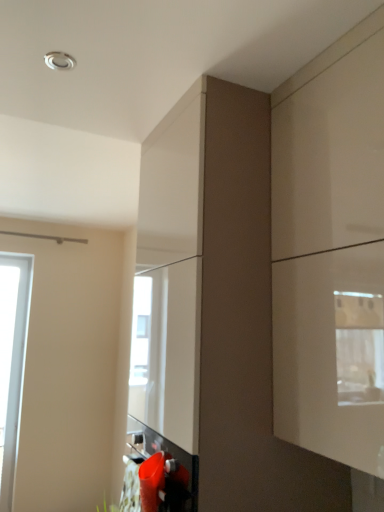
The image size is (384, 512). What do you see at coordinates (11, 362) in the screenshot? I see `white glass window at left` at bounding box center [11, 362].

Find the location of a particular element. The height and width of the screenshot is (512, 384). white glass window at left is located at coordinates (11, 362).

This screenshot has height=512, width=384. In order to click on white glass window at left in this screenshot , I will do `click(11, 362)`.